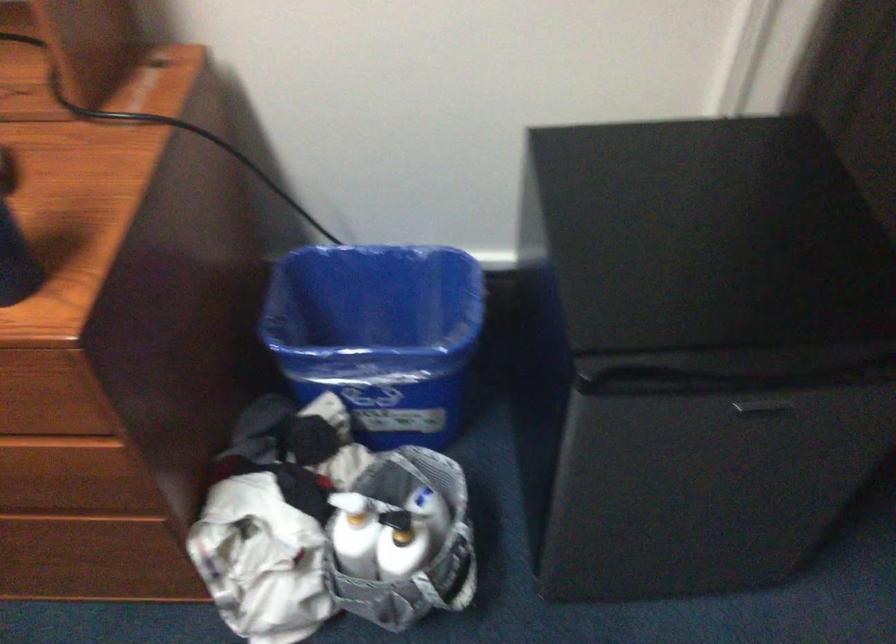
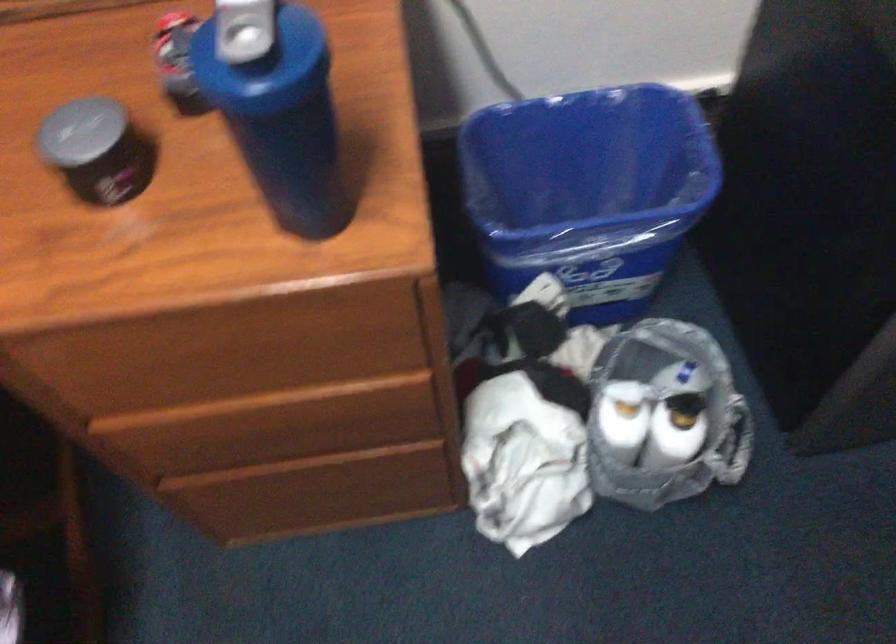
Question: I am providing you with two images of the same scene from different viewpoints. Which of the following objects are not visible in image2?

Choices:
 (A) drawer handle
 (B) shaker bottle cap
 (C) blue trash can
 (D) none of these

Answer: (D)